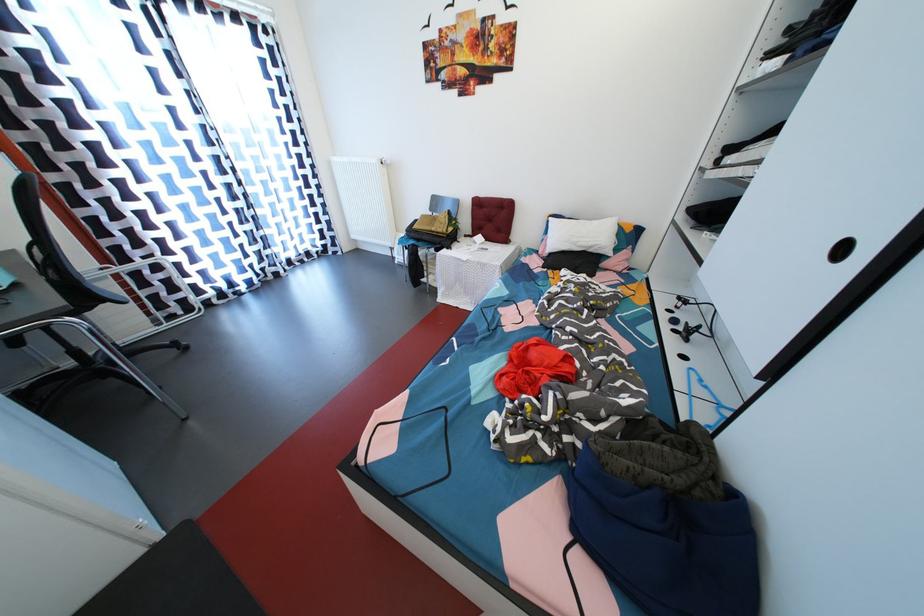
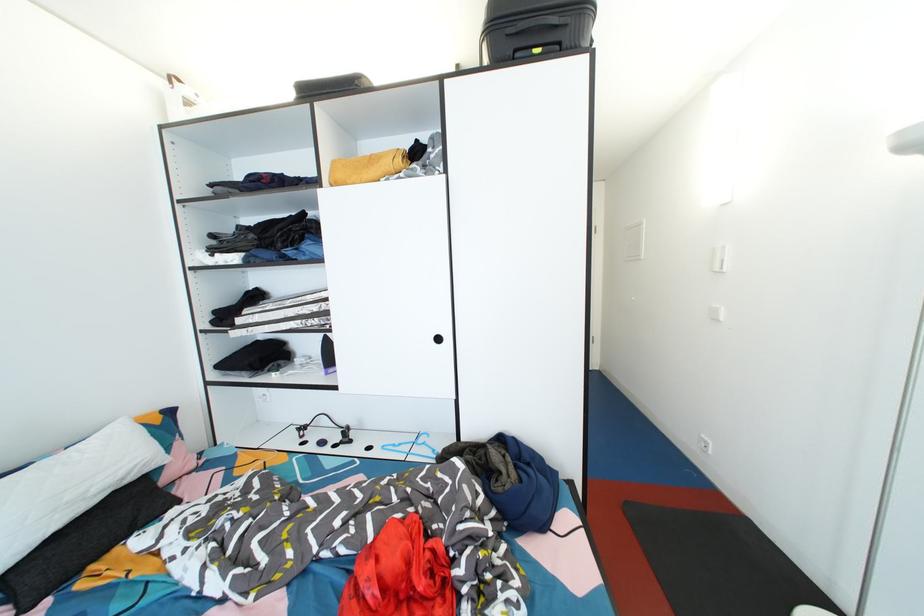
Where in the second image is the point corresponding to pixel 556 259 from the first image?

(8, 583)